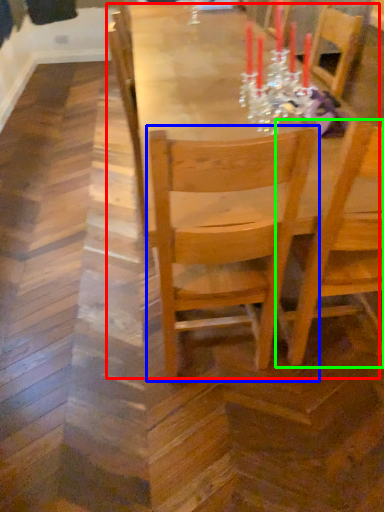
Question: Which object is positioned farthest from table (highlighted by a red box)? Select from chair (highlighted by a blue box) and chair (highlighted by a green box).

Choices:
 (A) chair
 (B) chair

Answer: (B)